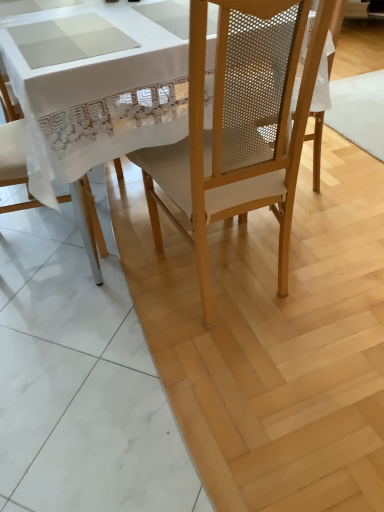
Find the location of a particular element. This screenshot has height=512, width=384. free spot to the right of matte wood chair at center, which is counted as the second chair, starting from the left is located at coordinates (327, 259).